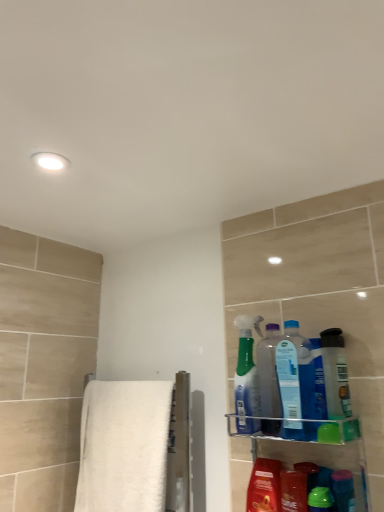
Question: From the image's perspective, does translucent plastic bottle at right appear lower than shiny plastic mouthwash at lower right?

Choices:
 (A) no
 (B) yes

Answer: (A)

Question: Does translucent plastic bottle at right turn towards shiny plastic mouthwash at lower right?

Choices:
 (A) yes
 (B) no

Answer: (B)

Question: Does translucent plastic bottle at right have a lesser height compared to shiny plastic mouthwash at lower right?

Choices:
 (A) yes
 (B) no

Answer: (A)

Question: From the image's perspective, is translucent plastic bottle at right on top of shiny plastic mouthwash at lower right?

Choices:
 (A) yes
 (B) no

Answer: (A)

Question: Considering the relative positions of translucent plastic bottle at right and shiny plastic mouthwash at lower right in the image provided, is translucent plastic bottle at right to the left of shiny plastic mouthwash at lower right from the viewer's perspective?

Choices:
 (A) no
 (B) yes

Answer: (A)

Question: From a real-world perspective, relative to green glossy bottle at lower right, which is counted as the second cleaning product, starting from the right, is translucent plastic bottle at upper right, which ranks as the 4th cleaning product in right-to-left order, vertically above or below?

Choices:
 (A) above
 (B) below

Answer: (A)

Question: Considering the relative positions of translucent plastic bottle at upper right, which ranks as the 4th cleaning product in right-to-left order, and green glossy bottle at lower right, which ranks as the 4th cleaning product in left-to-right order, in the image provided, is translucent plastic bottle at upper right, which ranks as the 4th cleaning product in right-to-left order, to the left or to the right of green glossy bottle at lower right, which ranks as the 4th cleaning product in left-to-right order,?

Choices:
 (A) right
 (B) left

Answer: (B)

Question: Considering their positions, is translucent plastic bottle at upper right, the second cleaning product positioned from the left, located in front of or behind green glossy bottle at lower right, which ranks as the 4th cleaning product in left-to-right order?

Choices:
 (A) behind
 (B) front

Answer: (A)

Question: Is translucent plastic bottle at upper right, which ranks as the 4th cleaning product in right-to-left order, taller or shorter than green glossy bottle at lower right, which is counted as the second cleaning product, starting from the right?

Choices:
 (A) short
 (B) tall

Answer: (B)

Question: From the image's perspective, is clear plastic shelf at lower right positioned above or below shiny plastic mouthwash at lower right?

Choices:
 (A) above
 (B) below

Answer: (A)

Question: Considering the positions of point click(319, 442) and point click(271, 494), is point click(319, 442) closer or farther from the camera than point click(271, 494)?

Choices:
 (A) closer
 (B) farther

Answer: (A)

Question: Would you say clear plastic shelf at lower right is to the left or to the right of shiny plastic mouthwash at lower right in the picture?

Choices:
 (A) right
 (B) left

Answer: (A)

Question: Looking at their shapes, would you say clear plastic shelf at lower right is wider or thinner than shiny plastic mouthwash at lower right?

Choices:
 (A) wide
 (B) thin

Answer: (A)

Question: Based on their positions, is green glossy bottle at lower right, which is counted as the second cleaning product, starting from the right, located to the left or right of translucent plastic spray bottle at upper right, placed as the third cleaning product when sorted from right to left?

Choices:
 (A) right
 (B) left

Answer: (A)

Question: Is green glossy bottle at lower right, which ranks as the 4th cleaning product in left-to-right order, wider or thinner than translucent plastic spray bottle at upper right, the third cleaning product when ordered from left to right?

Choices:
 (A) thin
 (B) wide

Answer: (A)